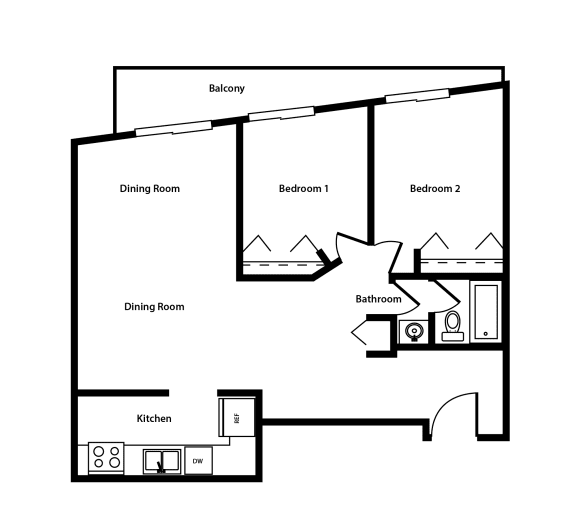
The image size is (576, 518). Identify the location of door. (295, 244).